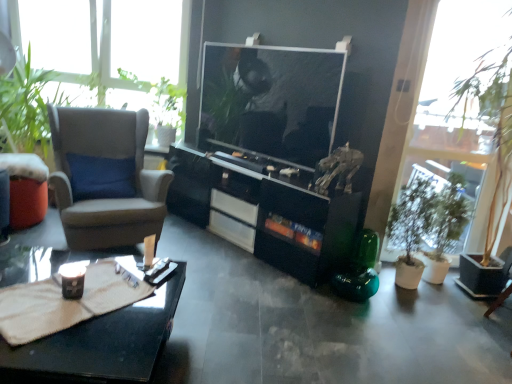
The image size is (512, 384). Identify the location of free space above black glossy coffee table at lower left (from a real-world perspective). (65, 299).